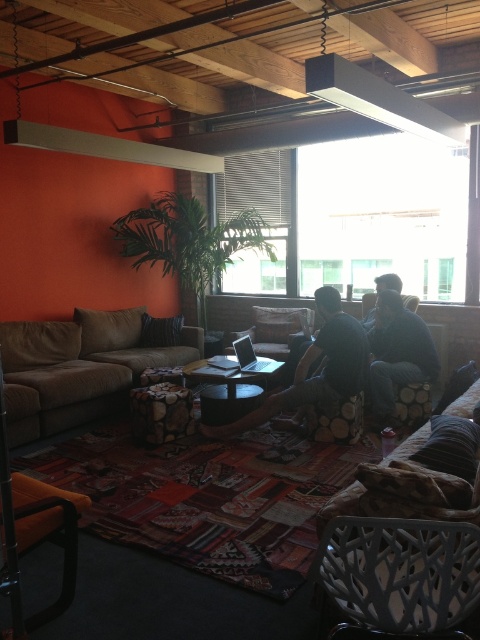
Who is positioned more to the right, black textured armchair at center or dark gray fabric couch at center?

From the viewer's perspective, black textured armchair at center appears more on the right side.

What do you see at coordinates (400, 572) in the screenshot? This screenshot has width=480, height=640. I see `black textured armchair at center` at bounding box center [400, 572].

Between point (404, 568) and point (339, 307), which one is positioned behind?

Point (339, 307)

This screenshot has width=480, height=640. Find the location of `black textured armchair at center`. black textured armchair at center is located at coordinates (400, 572).

Does brown fabric couch at left appear over matte white beam at upper center?

No, brown fabric couch at left is not above matte white beam at upper center.

Is brown fabric couch at left positioned before matte white beam at upper center?

No, brown fabric couch at left is behind matte white beam at upper center.

Locate an element on the screen. The width and height of the screenshot is (480, 640). brown fabric couch at left is located at coordinates (78, 368).

In order to click on brown fabric couch at left in this screenshot , I will do `click(78, 368)`.

Between brown fabric couch at left and dark blue jeans at center, which one is positioned higher?

brown fabric couch at left is higher up.

Which is more to the left, brown fabric couch at left or dark blue jeans at center?

Positioned to the left is brown fabric couch at left.

Is point (44, 328) more distant than point (395, 326)?

Yes.

Where is `brown fabric couch at left`? The width and height of the screenshot is (480, 640). brown fabric couch at left is located at coordinates (78, 368).